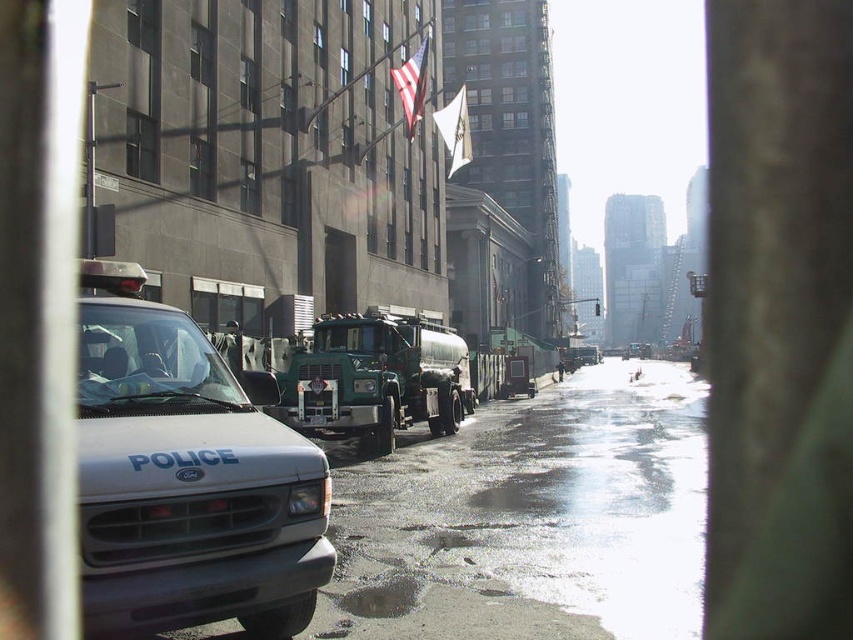
Is point (189, 552) positioned after point (379, 413)?

No, (189, 552) is closer to viewer.

Does white matte police van at left have a lesser width compared to green matte tanker truck at center?

Yes.

Is point (126, 563) closer to viewer compared to point (306, 420)?

That is True.

Where is `white matte police van at left`? The image size is (853, 640). white matte police van at left is located at coordinates (186, 477).